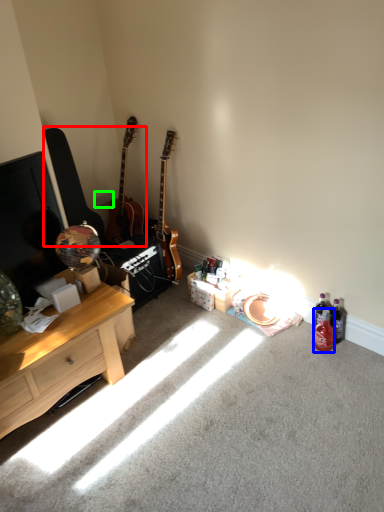
Question: Which is farther away from guitars (highlighted by a red box)? bottle (highlighted by a blue box) or power outlet (highlighted by a green box)?

Choices:
 (A) bottle
 (B) power outlet

Answer: (A)